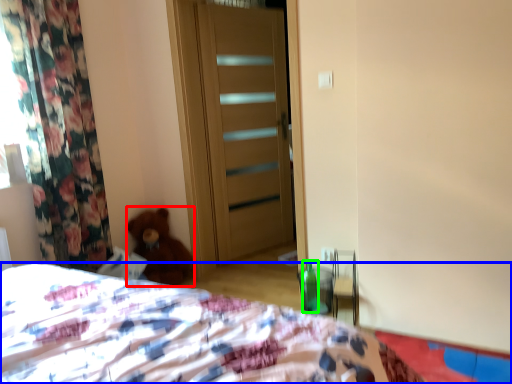
Question: Which is nearer to the teddy bear (highlighted by a red box)? bed (highlighted by a blue box) or bottle (highlighted by a green box).

Choices:
 (A) bed
 (B) bottle

Answer: (B)